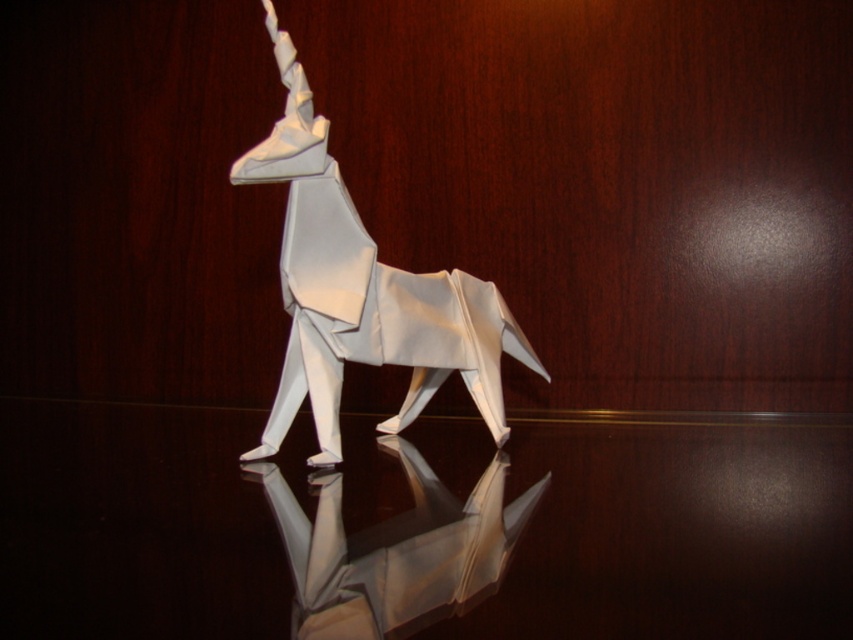
Can you confirm if white paper origami deer at center is shorter than white paper origami at center?

No, white paper origami deer at center is not shorter than white paper origami at center.

What do you see at coordinates (363, 291) in the screenshot?
I see `white paper origami deer at center` at bounding box center [363, 291].

The image size is (853, 640). In order to click on white paper origami deer at center in this screenshot , I will do `click(363, 291)`.